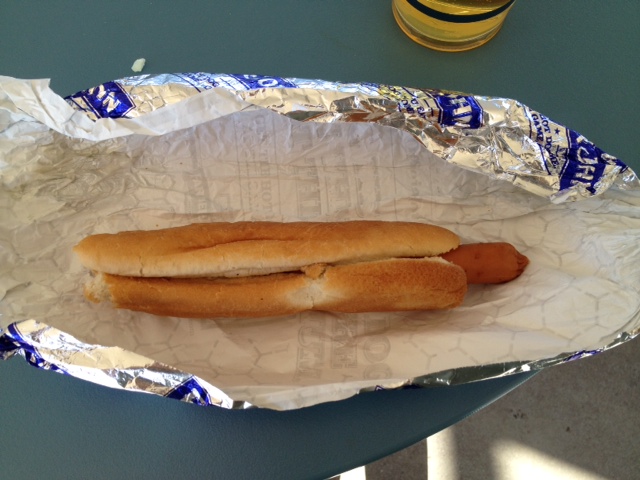
In order to click on table in this screenshot , I will do `click(588, 192)`.